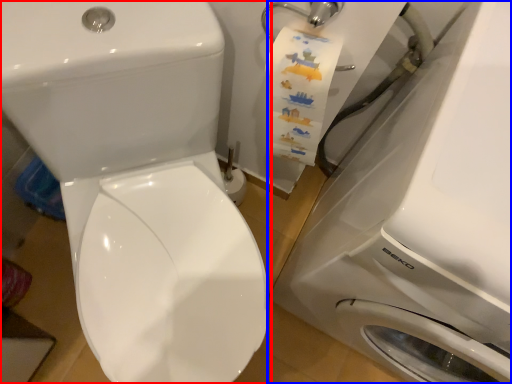
Question: Which object appears farthest to the camera in this image, toilet (highlighted by a red box) or washing machine (highlighted by a blue box)?

Choices:
 (A) toilet
 (B) washing machine

Answer: (A)